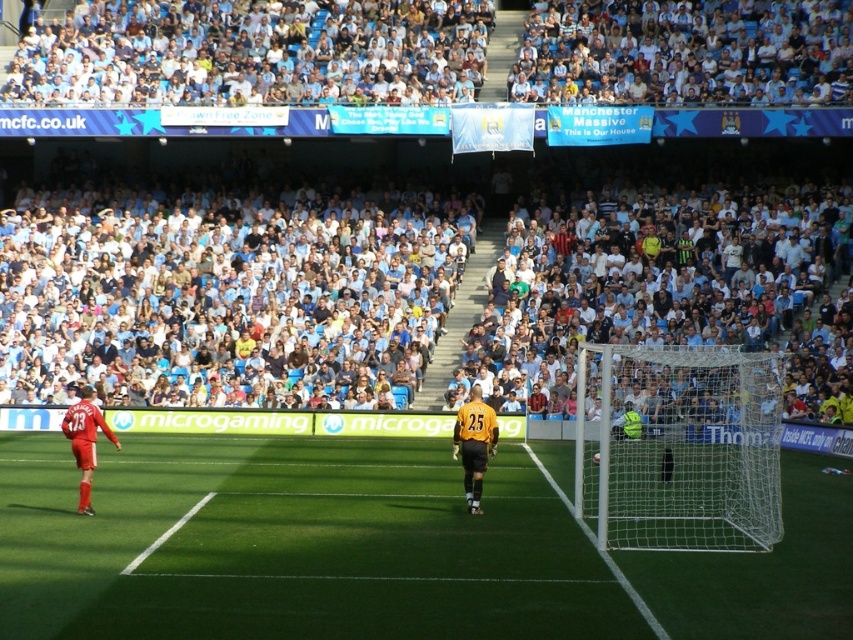
You are a photographer at the stadium and want to capture a photo of the white mesh net at right without the white fabric crowd at upper center blocking it. Can you adjust your camera angle to achieve this?

The white fabric crowd at upper center is much taller than the white mesh net at right, so adjusting the camera angle downward might help avoid the crowd blocking the net.